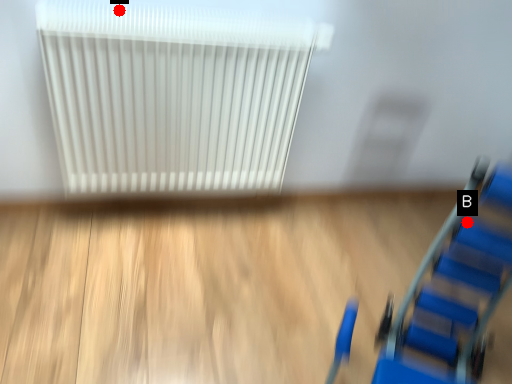
Question: Two points are circled on the image, labeled by A and B beside each circle. Which point is closer to the camera?

Choices:
 (A) A is closer
 (B) B is closer

Answer: (B)